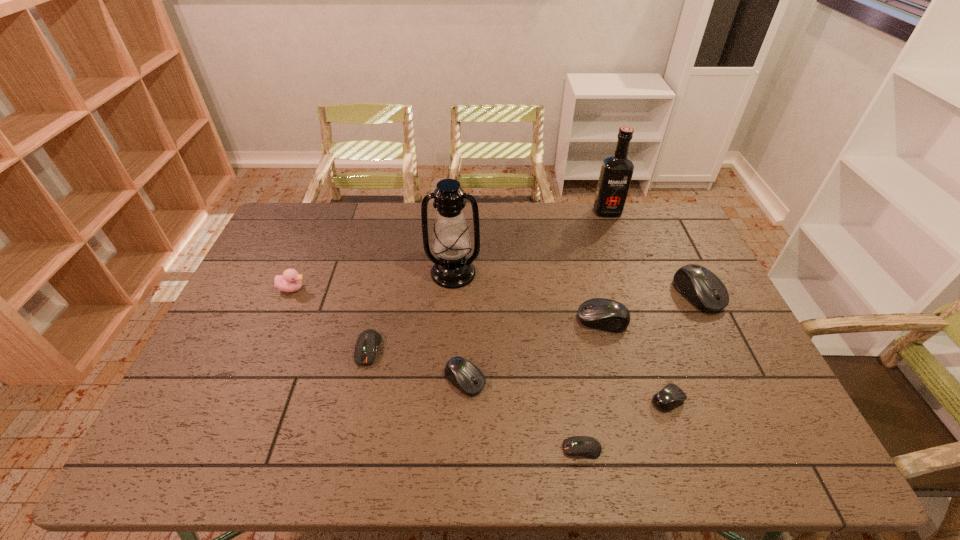
Identify the location of vacant area between the nearer dark computer equipment and the smallest black mouse. The height and width of the screenshot is (540, 960). (625, 424).

At what (x,y) coordinates should I click in order to perform the action: click on blank region between the fifth shortest object and the farther dark computer equipment. Please return your answer as a coordinate pair (x, y). The height and width of the screenshot is (540, 960). Looking at the image, I should click on (485, 334).

Identify the location of free space between the oil lamp and the fifth shortest object. (528, 296).

Image resolution: width=960 pixels, height=540 pixels. In order to click on free space between the third smallest black mouse and the smallest black mouse in this screenshot , I will do `click(636, 360)`.

I want to click on vacant space that's between the oil lamp and the second smallest black mouse, so click(x=459, y=326).

The image size is (960, 540). What are the coordinates of `free area in between the farther dark computer equipment and the smallest black mouse` in the screenshot? It's located at (518, 374).

You are a GUI agent. You are given a task and a screenshot of the screen. Output one action in this format:
    pyautogui.click(x=<x>, y=<y>)
    Task: Click on the free point between the liquor and the black oil lamp
    
    Given the screenshot: What is the action you would take?
    pyautogui.click(x=530, y=242)

Choose which object is the third nearest neighbor to the farthest object. Please provide its 2D coordinates. Your answer should be formatted as a tuple, i.e. [(x, y)], where the tuple contains the x and y coordinates of a point satisfying the conditions above.

[(451, 242)]

Identify which object is the eighth closest to the second smallest black mouse. Please provide its 2D coordinates. Your answer should be formatted as a tuple, i.e. [(x, y)], where the tuple contains the x and y coordinates of a point satisfying the conditions above.

[(616, 172)]

You are a GUI agent. You are given a task and a screenshot of the screen. Output one action in this format:
    pyautogui.click(x=<x>, y=<y>)
    Task: Click on the fifth closest computer equipment to the sixth tallest object
    
    Given the screenshot: What is the action you would take?
    [701, 287]